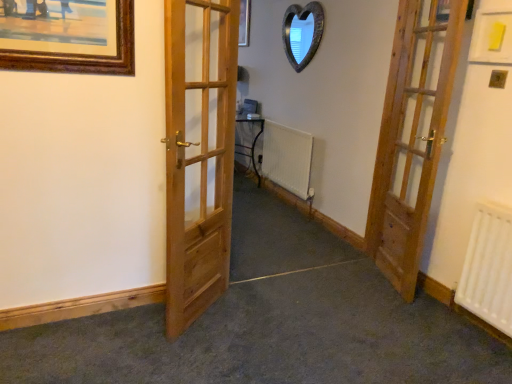
Question: Is natural wood door at center, which is counted as the first door, starting from the left, turned away from wooden heart-shaped mirror at upper center?

Choices:
 (A) yes
 (B) no

Answer: (B)

Question: Can you confirm if natural wood door at center, acting as the second door starting from the right, is thinner than wooden heart-shaped mirror at upper center?

Choices:
 (A) no
 (B) yes

Answer: (A)

Question: From the image's perspective, is natural wood door at center, which is counted as the first door, starting from the left, below wooden heart-shaped mirror at upper center?

Choices:
 (A) yes
 (B) no

Answer: (A)

Question: Can we say natural wood door at center, which is counted as the first door, starting from the left, lies outside wooden heart-shaped mirror at upper center?

Choices:
 (A) yes
 (B) no

Answer: (A)

Question: Can wooden heart-shaped mirror at upper center be found inside natural wood door at center, acting as the second door starting from the right?

Choices:
 (A) yes
 (B) no

Answer: (B)

Question: From a real-world perspective, is natural wood door at center, which is counted as the first door, starting from the left, under wooden heart-shaped mirror at upper center?

Choices:
 (A) no
 (B) yes

Answer: (B)

Question: Is wooden door at right, positioned as the second door in left-to-right order, completely or partially inside natural wood door at center, acting as the second door starting from the right?

Choices:
 (A) yes
 (B) no

Answer: (B)

Question: Is natural wood door at center, acting as the second door starting from the right, positioned in front of wooden door at right, which ranks as the 1th door in right-to-left order?

Choices:
 (A) yes
 (B) no

Answer: (A)

Question: From the image's perspective, would you say natural wood door at center, which is counted as the first door, starting from the left, is positioned over wooden door at right, positioned as the second door in left-to-right order?

Choices:
 (A) no
 (B) yes

Answer: (A)

Question: Is natural wood door at center, which is counted as the first door, starting from the left, far from wooden door at right, which ranks as the 1th door in right-to-left order?

Choices:
 (A) no
 (B) yes

Answer: (B)

Question: Is natural wood door at center, acting as the second door starting from the right, smaller than wooden door at right, which ranks as the 1th door in right-to-left order?

Choices:
 (A) yes
 (B) no

Answer: (B)

Question: Is natural wood door at center, which is counted as the first door, starting from the left, not inside wooden door at right, which ranks as the 1th door in right-to-left order?

Choices:
 (A) yes
 (B) no

Answer: (A)

Question: Is natural wood door at center, which is counted as the first door, starting from the left, positioned with its back to white matte radiator at center, positioned as the 2th radiator in right-to-left order?

Choices:
 (A) yes
 (B) no

Answer: (B)